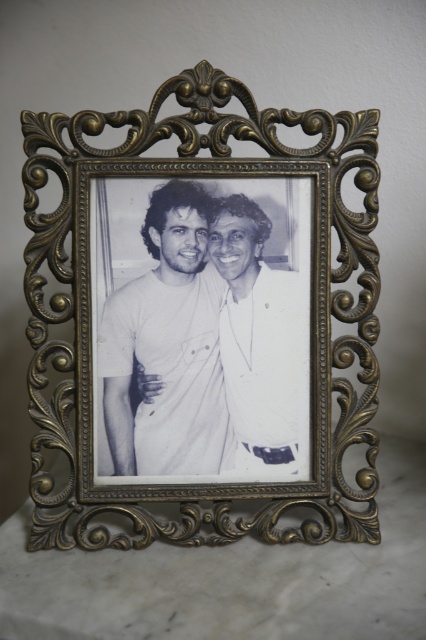
You want to replace the white paper photo at center with a new one that is exactly the same size as the gold ornate frame at center. Is this possible?

The white paper photo at center has a smaller width than the gold ornate frame at center, so the new photo needs to be larger to match the frame.

You are an interior designer arranging a living room. You have a gold ornate frame at center and a white matte shirt at center. Which object is closer to you when standing in front of the living room wall?

The gold ornate frame at center is closer to you than the white matte shirt at center because it is in front of it.

You are an interior designer assessing the placement of the gold ornate frame at center and the white matte shirt at center in a room. Which object is taller?

The gold ornate frame at center is taller than the white matte shirt at center.